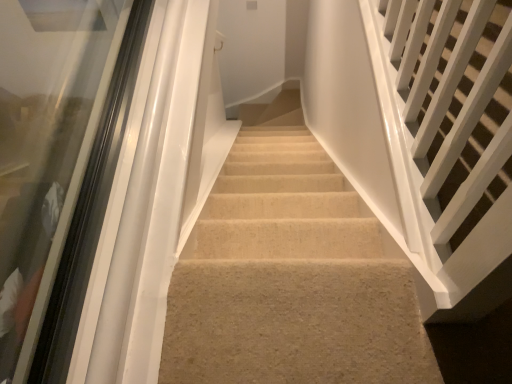
Question: Does white glossy rail at right, the second stairs in the left-to-right sequence, contain transparent glass door at left?

Choices:
 (A) no
 (B) yes

Answer: (A)

Question: Can you confirm if white glossy rail at right, the second stairs in the left-to-right sequence, is positioned to the left of transparent glass door at left?

Choices:
 (A) no
 (B) yes

Answer: (A)

Question: Considering the relative sizes of white glossy rail at right, which is the 1th stairs from right to left, and transparent glass door at left in the image provided, is white glossy rail at right, which is the 1th stairs from right to left, bigger than transparent glass door at left?

Choices:
 (A) no
 (B) yes

Answer: (B)

Question: From a real-world perspective, is white glossy rail at right, which is the 1th stairs from right to left, physically below transparent glass door at left?

Choices:
 (A) yes
 (B) no

Answer: (B)

Question: Is white glossy rail at right, the second stairs in the left-to-right sequence, next to transparent glass door at left?

Choices:
 (A) yes
 (B) no

Answer: (B)

Question: Is white glossy rail at right, which is the 1th stairs from right to left, positioned with its back to transparent glass door at left?

Choices:
 (A) yes
 (B) no

Answer: (B)

Question: Is transparent glass door at left to the right of beige carpet at center, which is counted as the first stairs, starting from the left, from the viewer's perspective?

Choices:
 (A) no
 (B) yes

Answer: (A)

Question: From the image's perspective, would you say transparent glass door at left is shown under beige carpet at center, which is counted as the first stairs, starting from the left?

Choices:
 (A) no
 (B) yes

Answer: (A)

Question: Can you confirm if transparent glass door at left is thinner than beige carpet at center, the second stairs from the right?

Choices:
 (A) yes
 (B) no

Answer: (A)

Question: From a real-world perspective, is transparent glass door at left positioned over beige carpet at center, the second stairs from the right, based on gravity?

Choices:
 (A) no
 (B) yes

Answer: (B)

Question: Can you confirm if transparent glass door at left is bigger than beige carpet at center, which is counted as the first stairs, starting from the left?

Choices:
 (A) yes
 (B) no

Answer: (A)

Question: Does transparent glass door at left have a greater width compared to beige carpet at center, the second stairs from the right?

Choices:
 (A) yes
 (B) no

Answer: (B)

Question: Is white glossy rail at right, which is the 1th stairs from right to left, positioned far away from beige carpet at center, the second stairs from the right?

Choices:
 (A) no
 (B) yes

Answer: (A)